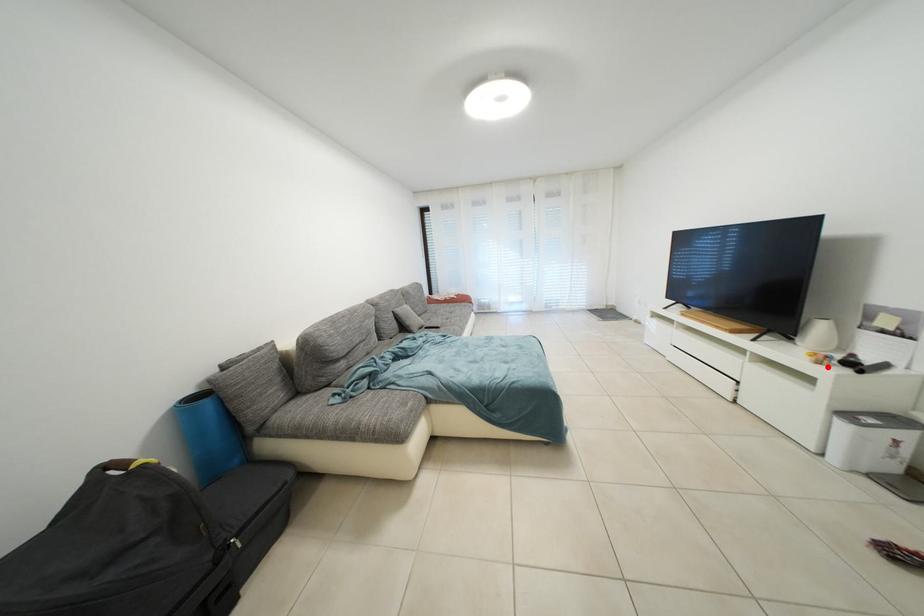
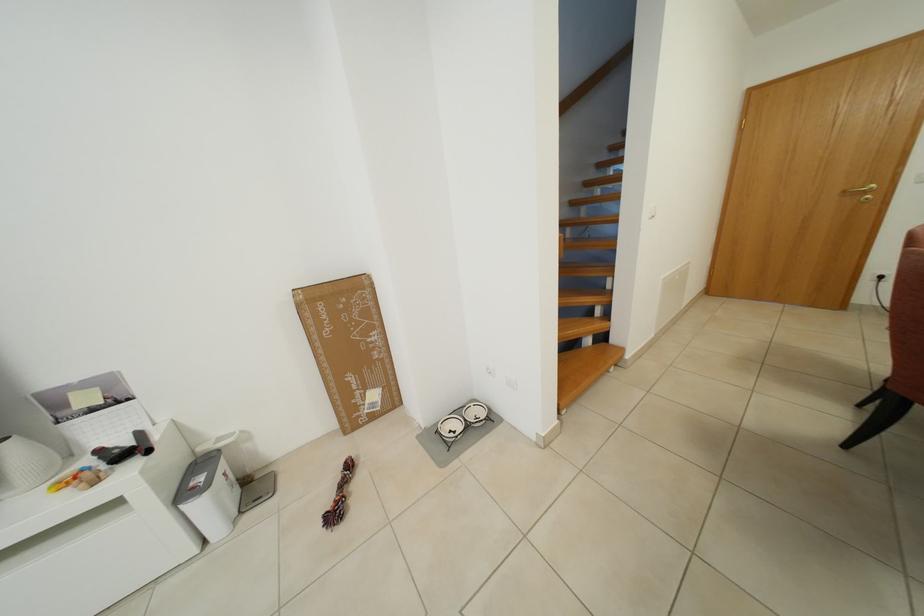
The point at the highlighted location is marked in the first image. Where is the corresponding point in the second image?

(103, 485)